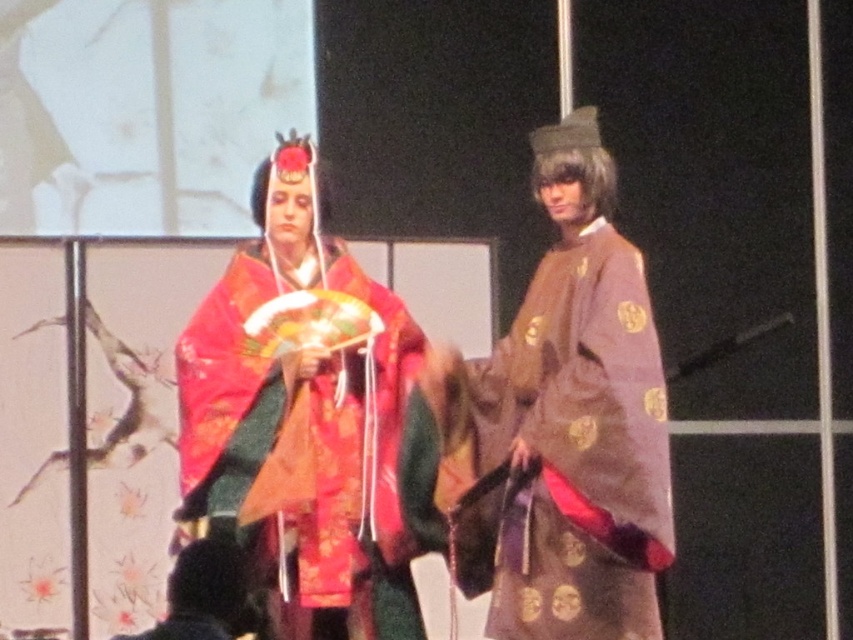
You are an observer standing in front of the two performers. Which performer is wearing the matte brown robe at center located to the right of the silky red kimono at center?

The person on the right is wearing the matte brown robe at center, which is positioned on the right side of the silky red kimono at center.